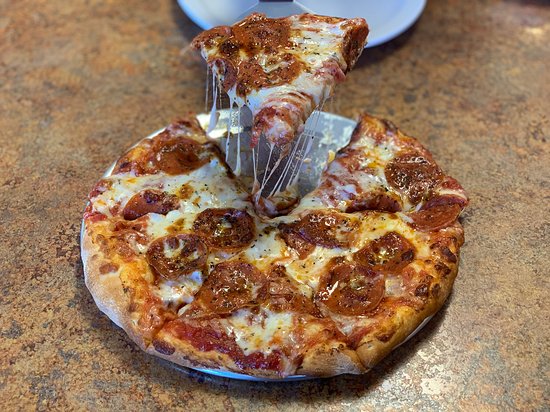
What are the coordinates of `table to the left of pizza` in the screenshot? It's located at (50, 227).